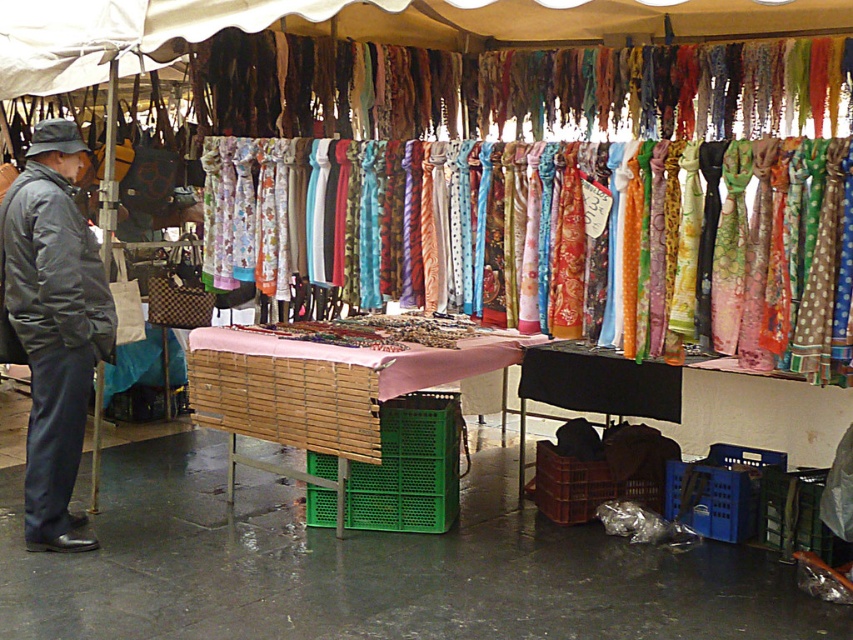
You are a customer at the market stall. You want to see the floral silk scarf at center better. Can you see it clearly without moving the dark gray fabric jacket at left?

The floral silk scarf at center is behind the dark gray fabric jacket at left, so it might be partially or fully obscured. To see it clearly, you would need to move the dark gray fabric jacket at left out of the way.